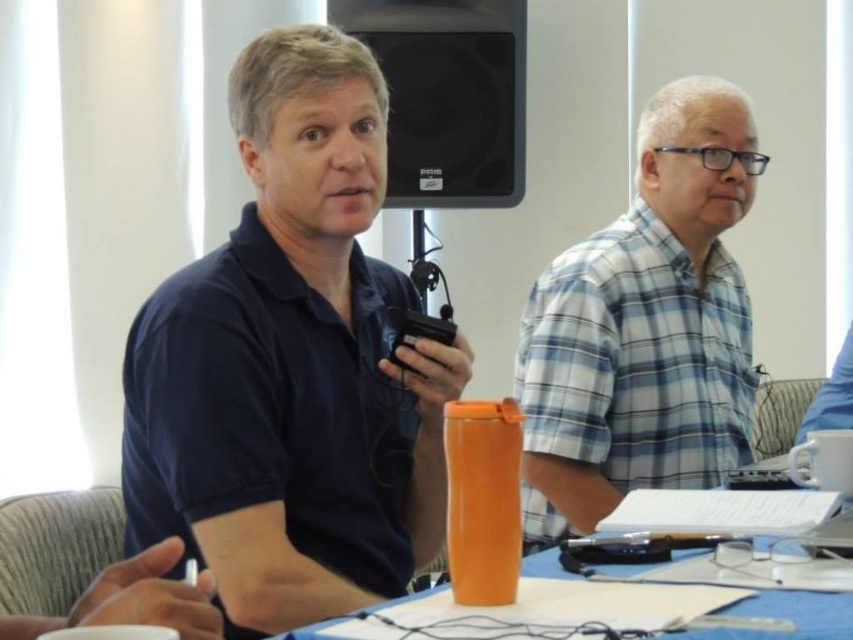
You are organizing a small conference and need to ensure that all participants have enough space to place their cups on the table. Given the items present, can the orange plastic cup at center be placed directly in front of the dark blue shirt at center without obstructing their view or access to the microphone?

The dark blue shirt at center has a greater height compared to the orange plastic cup at center. Since the cup is shorter, placing it directly in front of the dark blue shirt at center would not obstruct their view or access to the microphone.

Looking at this image, you are a photographer at the back of the room. You need to take a photo of both the dark blue shirt at center and the orange plastic cup at center. Can you see both objects in your camera frame at the same time?

The dark blue shirt at center is above the orange plastic cup at center, so yes, both objects are visible in the same frame since they are stacked vertically.